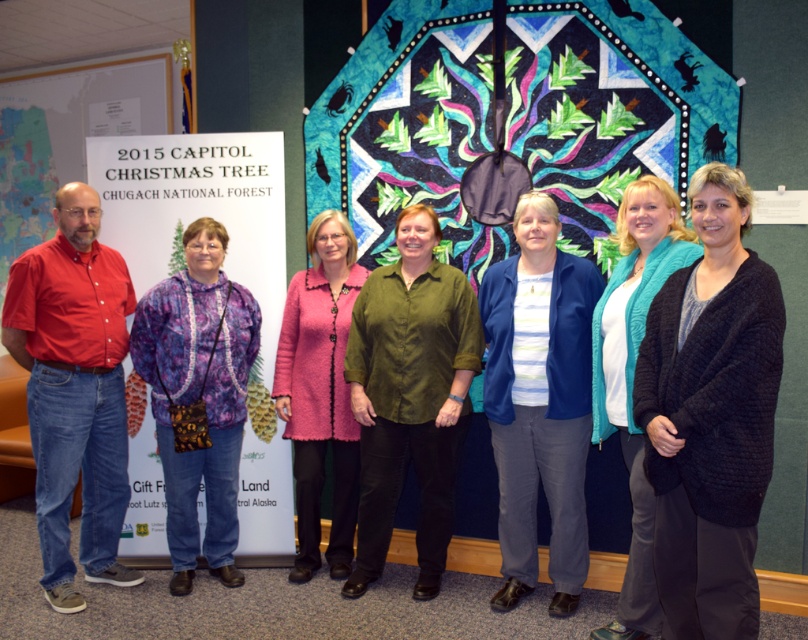
Can you confirm if matte red shirt at left is bigger than blue cotton pants at center?

Yes, matte red shirt at left is bigger than blue cotton pants at center.

Who is more distant from viewer, (70,248) or (577,435)?

Positioned behind is point (70,248).

Locate an element on the screen. The height and width of the screenshot is (640, 808). matte red shirt at left is located at coordinates (74, 388).

Who is shorter, black knitted cardigan at center or pink textured coat at center?

black knitted cardigan at center is shorter.

Is point (670, 477) more distant than point (330, 385)?

No, it is in front of (330, 385).

Describe the element at coordinates (710, 416) in the screenshot. This screenshot has height=640, width=808. I see `black knitted cardigan at center` at that location.

The image size is (808, 640). In order to click on black knitted cardigan at center in this screenshot , I will do `click(710, 416)`.

Is blue cotton pants at center shorter than teal fuzzy cardigan at center?

Indeed, blue cotton pants at center has a lesser height compared to teal fuzzy cardigan at center.

Is blue cotton pants at center to the right of teal fuzzy cardigan at center from the viewer's perspective?

In fact, blue cotton pants at center is to the left of teal fuzzy cardigan at center.

Which is in front, point (579, 451) or point (612, 294)?

Positioned in front is point (612, 294).

Where is `blue cotton pants at center`? The height and width of the screenshot is (640, 808). blue cotton pants at center is located at coordinates (539, 401).